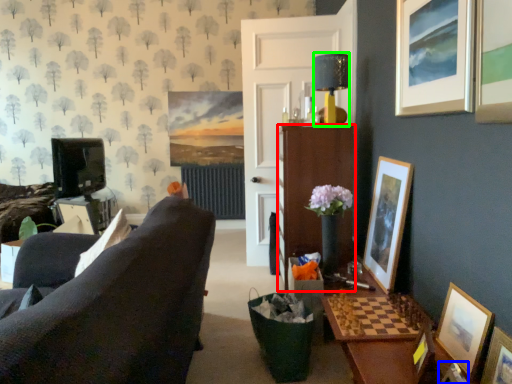
Question: Which object is the farthest from cabinetry (highlighted by a red box)? Choose among these: picture frame (highlighted by a blue box) or lamp (highlighted by a green box).

Choices:
 (A) picture frame
 (B) lamp

Answer: (A)